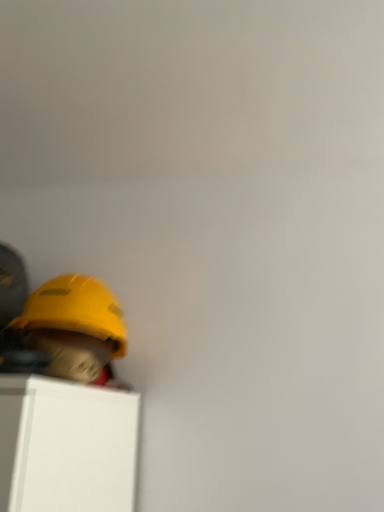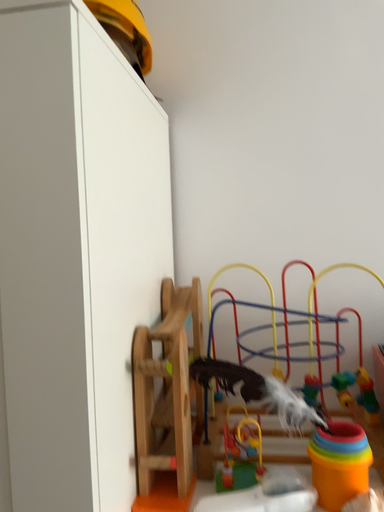
Question: How did the camera likely rotate when shooting the video?

Choices:
 (A) rotated upward
 (B) rotated downward

Answer: (B)